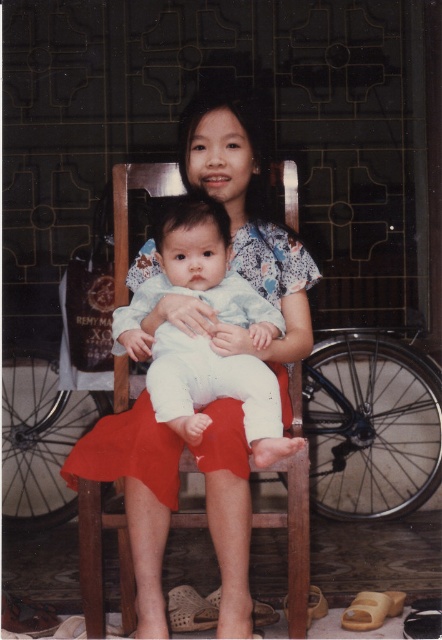
You are a photographer setting up for a family portrait. You need to ensure that both the matte floral dress at center and the light blue fabric baby at center are clearly visible in the shot. Given their sizes, which object should you adjust your camera focus on first to ensure proper framing?

The matte floral dress at center is bigger than the light blue fabric baby at center, so you should focus on the matte floral dress at center first to ensure it fits within the frame before adjusting for the smaller object.